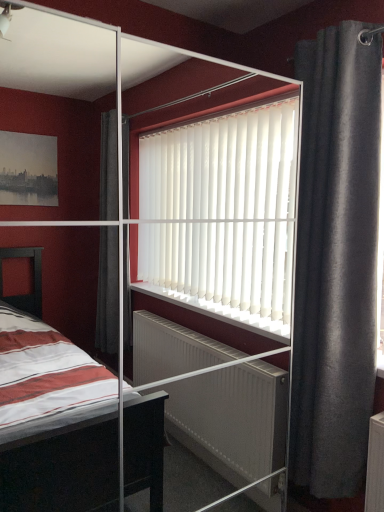
Locate an element on the screen. This screenshot has height=512, width=384. transparent glass screen door at center is located at coordinates (230, 241).

The width and height of the screenshot is (384, 512). Describe the element at coordinates (230, 241) in the screenshot. I see `transparent glass screen door at center` at that location.

Describe the element at coordinates (336, 261) in the screenshot. The height and width of the screenshot is (512, 384). I see `dark gray fabric curtain at right` at that location.

You are a GUI agent. You are given a task and a screenshot of the screen. Output one action in this format:
    pyautogui.click(x=<x>, y=<y>)
    Task: Click on the dark gray fabric curtain at right
    
    Given the screenshot: What is the action you would take?
    pyautogui.click(x=336, y=261)

Image resolution: width=384 pixels, height=512 pixels. In order to click on transparent glass screen door at center in this screenshot , I will do `click(230, 241)`.

Based on their positions, is dark gray fabric curtain at right located to the left or right of transparent glass screen door at center?

dark gray fabric curtain at right is to the right of transparent glass screen door at center.

Between dark gray fabric curtain at right and transparent glass screen door at center, which one is positioned behind?

dark gray fabric curtain at right is more distant.

Does point (335, 465) come farther from viewer compared to point (217, 123)?

No, it is in front of (217, 123).

Looking at this image, from the image's perspective, is dark gray fabric curtain at right above or below transparent glass screen door at center?

From the image's perspective, dark gray fabric curtain at right appears above transparent glass screen door at center.

From a real-world perspective, is dark gray fabric curtain at right positioned above or below transparent glass screen door at center?

From a real-world perspective, dark gray fabric curtain at right is physically above transparent glass screen door at center.

Which of these two, dark gray fabric curtain at right or transparent glass screen door at center, is wider?

Wider between the two is transparent glass screen door at center.

Considering the relative sizes of dark gray fabric curtain at right and transparent glass screen door at center in the image provided, is dark gray fabric curtain at right taller than transparent glass screen door at center?

No.

Can you confirm if dark gray fabric curtain at right is bigger than transparent glass screen door at center?

No.

Would you say dark gray fabric curtain at right is outside transparent glass screen door at center?

That's correct, dark gray fabric curtain at right is outside of transparent glass screen door at center.

Is dark gray fabric curtain at right far away from transparent glass screen door at center?

No, dark gray fabric curtain at right is not far away from transparent glass screen door at center.

Is dark gray fabric curtain at right turned away from transparent glass screen door at center?

That's not correct — dark gray fabric curtain at right is not looking away from transparent glass screen door at center.

Can you tell me how much dark gray fabric curtain at right and transparent glass screen door at center differ in facing direction?

The angular difference between dark gray fabric curtain at right and transparent glass screen door at center is 88.7 degrees.

Where is `screen door below the dark gray fabric curtain at right (from a real-world perspective)`? The height and width of the screenshot is (512, 384). screen door below the dark gray fabric curtain at right (from a real-world perspective) is located at coordinates (230, 241).

Which is more to the right, transparent glass screen door at center or dark gray fabric curtain at right?

dark gray fabric curtain at right.

Is transparent glass screen door at center positioned behind dark gray fabric curtain at right?

That is False.

Which point is more distant from viewer, (246,242) or (306,121)?

The point (246,242) is farther from the camera.

From the image's perspective, does transparent glass screen door at center appear lower than dark gray fabric curtain at right?

Yes.

From a real-world perspective, is transparent glass screen door at center physically below dark gray fabric curtain at right?

Yes, from a real-world perspective, transparent glass screen door at center is beneath dark gray fabric curtain at right.

Can you confirm if transparent glass screen door at center is thinner than dark gray fabric curtain at right?

No, transparent glass screen door at center is not thinner than dark gray fabric curtain at right.

Considering the sizes of objects transparent glass screen door at center and dark gray fabric curtain at right in the image provided, who is taller, transparent glass screen door at center or dark gray fabric curtain at right?

transparent glass screen door at center.

Based on their sizes in the image, would you say transparent glass screen door at center is bigger or smaller than dark gray fabric curtain at right?

Clearly, transparent glass screen door at center is larger in size than dark gray fabric curtain at right.

Would you say transparent glass screen door at center is inside or outside dark gray fabric curtain at right?

The correct answer is: outside.

Is transparent glass screen door at center touching dark gray fabric curtain at right?

No, transparent glass screen door at center is not beside dark gray fabric curtain at right.

Is transparent glass screen door at center facing towards dark gray fabric curtain at right?

No, transparent glass screen door at center is not turned towards dark gray fabric curtain at right.

Can you tell me how much transparent glass screen door at center and dark gray fabric curtain at right differ in facing direction?

88.7 degrees.

The image size is (384, 512). I want to click on curtain on the right side of transparent glass screen door at center, so click(336, 261).

Where is `curtain above the transparent glass screen door at center (from a real-world perspective)`? The height and width of the screenshot is (512, 384). curtain above the transparent glass screen door at center (from a real-world perspective) is located at coordinates (336, 261).

Locate an element on the screen. curtain behind the transparent glass screen door at center is located at coordinates (336, 261).